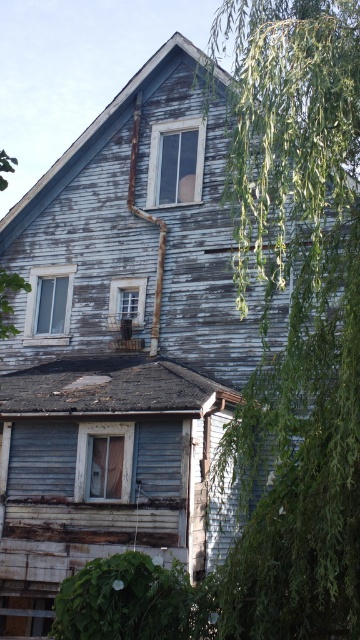
Question: Which of the following is the closest to the observer?

Choices:
 (A) transparent glass window at upper left
 (B) translucent plastic window at center
 (C) clear glass window at upper center
 (D) green leafy tree at right

Answer: (D)

Question: Which of the following is the closest to the observer?

Choices:
 (A) (128, 470)
 (B) (147, 180)
 (C) (263, 83)

Answer: (C)

Question: Among these objects, which one is farthest from the camera?

Choices:
 (A) transparent glass window at upper left
 (B) matte wood window at center

Answer: (A)

Question: Is green leafy tree at right below transparent glass window at upper left?

Choices:
 (A) no
 (B) yes

Answer: (A)

Question: Can you confirm if green leafy tree at right is positioned to the right of clear glass window at upper center?

Choices:
 (A) no
 (B) yes

Answer: (B)

Question: Does translucent plastic window at center have a smaller size compared to transparent glass window at upper left?

Choices:
 (A) no
 (B) yes

Answer: (B)